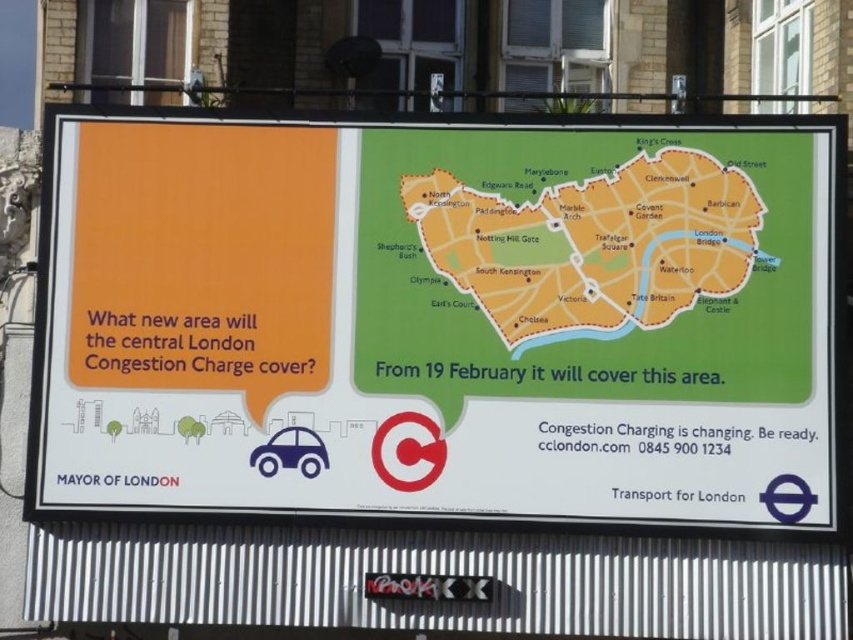
Question: Which of the following is the farthest from the observer?

Choices:
 (A) white paper map at upper center
 (B) orange paper map at center

Answer: (B)

Question: Considering the relative positions of white paper map at upper center and orange paper map at center in the image provided, where is white paper map at upper center located with respect to orange paper map at center?

Choices:
 (A) above
 (B) below

Answer: (B)

Question: Which point is closer to the camera taking this photo?

Choices:
 (A) (529, 273)
 (B) (759, 362)

Answer: (B)

Question: Can you confirm if white paper map at upper center is positioned above orange paper map at center?

Choices:
 (A) yes
 (B) no

Answer: (B)

Question: Is white paper map at upper center closer to camera compared to orange paper map at center?

Choices:
 (A) yes
 (B) no

Answer: (A)

Question: Which point appears farthest from the camera in this image?

Choices:
 (A) (660, 259)
 (B) (773, 236)

Answer: (B)